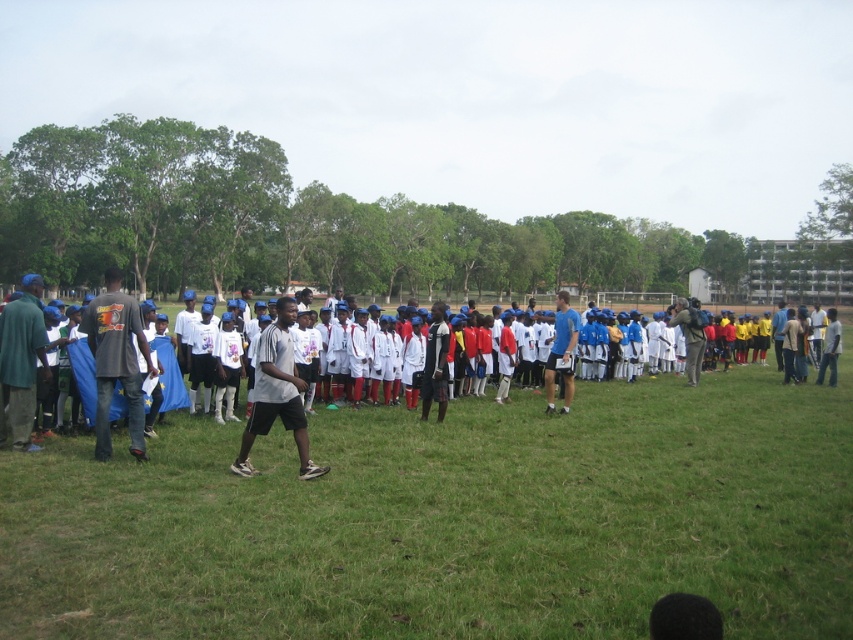
Question: Can you confirm if green grass at center is positioned to the right of white matte shirt at center?

Choices:
 (A) yes
 (B) no

Answer: (B)

Question: Considering the relative positions of white matte shirt at center and white matte shorts at center in the image provided, where is white matte shirt at center located with respect to white matte shorts at center?

Choices:
 (A) above
 (B) below

Answer: (B)

Question: Which of the following is the farthest from the observer?

Choices:
 (A) black matte shirt at left
 (B) white matte shorts at center
 (C) white matte shirt at center

Answer: (A)

Question: Among these points, which one is nearest to the camera?

Choices:
 (A) (624, 515)
 (B) (112, 289)
 (C) (389, 477)
 (D) (280, 355)

Answer: (A)

Question: Estimate the real-world distances between objects in this image. Which object is closer to the black matte shirt at left?

Choices:
 (A) green grass at center
 (B) white matte shorts at center
 (C) white matte shirt at center

Answer: (B)

Question: From the image, what is the correct spatial relationship of black matte shirt at left in relation to white matte shorts at center?

Choices:
 (A) left
 (B) right

Answer: (A)